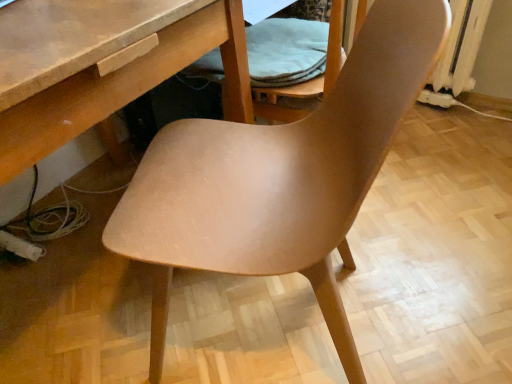
Question: Is matte wood chair at center looking in the opposite direction of light brown wood folding chair at center?

Choices:
 (A) yes
 (B) no

Answer: (B)

Question: Does matte wood chair at center touch light brown wood folding chair at center?

Choices:
 (A) no
 (B) yes

Answer: (A)

Question: Is matte wood chair at center to the left of light brown wood folding chair at center from the viewer's perspective?

Choices:
 (A) yes
 (B) no

Answer: (A)

Question: Is matte wood chair at center to the right of light brown wood folding chair at center from the viewer's perspective?

Choices:
 (A) no
 (B) yes

Answer: (A)

Question: Is matte wood chair at center wider than light brown wood folding chair at center?

Choices:
 (A) yes
 (B) no

Answer: (A)

Question: Could you tell me if matte wood chair at center is facing light brown wood folding chair at center?

Choices:
 (A) no
 (B) yes

Answer: (A)

Question: From a real-world perspective, is light brown wood folding chair at center beneath matte wood chair at center?

Choices:
 (A) no
 (B) yes

Answer: (A)

Question: Considering the relative positions of light brown wood folding chair at center and matte wood chair at center in the image provided, is light brown wood folding chair at center in front of matte wood chair at center?

Choices:
 (A) no
 (B) yes

Answer: (A)

Question: Is light brown wood folding chair at center wider than matte wood chair at center?

Choices:
 (A) no
 (B) yes

Answer: (A)

Question: Does light brown wood folding chair at center have a lesser width compared to matte wood chair at center?

Choices:
 (A) no
 (B) yes

Answer: (B)

Question: Considering the relative sizes of light brown wood folding chair at center and matte wood chair at center in the image provided, is light brown wood folding chair at center bigger than matte wood chair at center?

Choices:
 (A) yes
 (B) no

Answer: (B)

Question: Is there a large distance between light brown wood folding chair at center and matte wood chair at center?

Choices:
 (A) no
 (B) yes

Answer: (A)

Question: In the image, is matte wood chair at center positioned in front of or behind light brown wood folding chair at center?

Choices:
 (A) behind
 (B) front

Answer: (B)